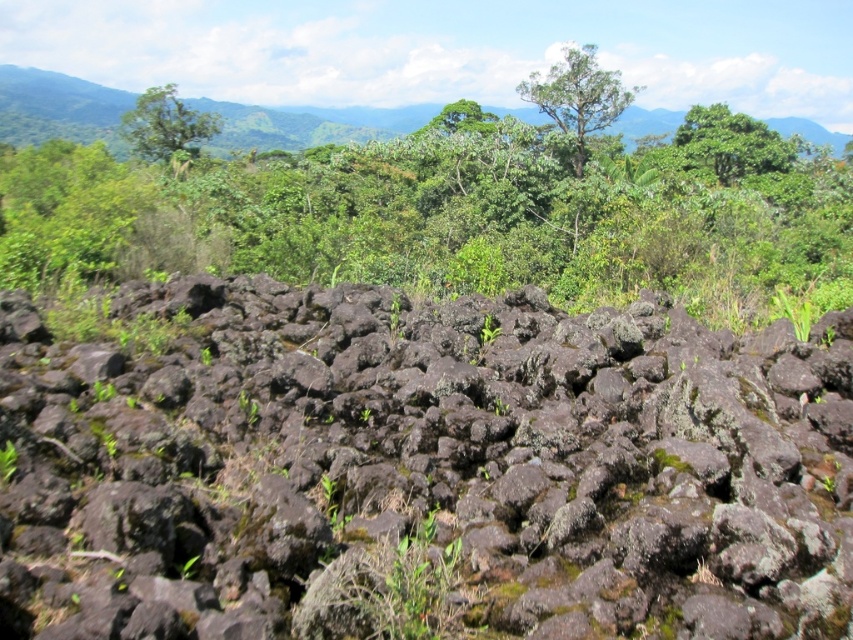
You are a hiker looking at the image and want to identify the smaller tree between the green leafy tree at upper center and the green leafy tree at upper left. Which one should you point out?

The green leafy tree at upper center is smaller in size compared to the green leafy tree at upper left, so you should point out the green leafy tree at upper center.

You are a hiker trying to navigate through the rocky terrain towards the forest. You notice two green leafy trees in the distance. Which tree, the green leafy tree at upper center or the green leafy tree at upper left, is closer to the foreground rocks?

The green leafy tree at upper left is closer to the foreground rocks because the green leafy tree at upper center is positioned over it, meaning it is further away.